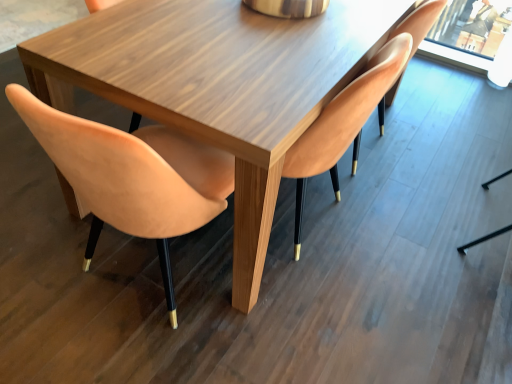
Question: Can you confirm if matte orange chair at upper right, the 3th chair in the left-to-right sequence, is taller than matte wood chair at center, which is the 2th chair from right to left?

Choices:
 (A) yes
 (B) no

Answer: (B)

Question: Can you confirm if matte orange chair at upper right, arranged as the 1th chair when viewed from the right, is smaller than matte wood chair at center, the 2th chair positioned from the left?

Choices:
 (A) yes
 (B) no

Answer: (A)

Question: Is matte orange chair at upper right, arranged as the 1th chair when viewed from the right, wider than matte wood chair at center, the 2th chair positioned from the left?

Choices:
 (A) yes
 (B) no

Answer: (B)

Question: From a real-world perspective, does matte orange chair at upper right, arranged as the 1th chair when viewed from the right, sit lower than matte wood chair at center, the 2th chair positioned from the left?

Choices:
 (A) yes
 (B) no

Answer: (A)

Question: Is matte orange chair at upper right, the 3th chair in the left-to-right sequence, looking in the opposite direction of matte wood chair at center, which is the 2th chair from right to left?

Choices:
 (A) yes
 (B) no

Answer: (B)

Question: Is matte orange chair at upper right, arranged as the 1th chair when viewed from the right, to the left of matte wood chair at center, the 2th chair positioned from the left, from the viewer's perspective?

Choices:
 (A) no
 (B) yes

Answer: (A)

Question: Is matte wood chair at center, which is the 2th chair from right to left, not close to suede-like peach chair at left, which ranks as the third chair in right-to-left order?

Choices:
 (A) no
 (B) yes

Answer: (A)

Question: Is matte wood chair at center, the 2th chair positioned from the left, shorter than suede-like peach chair at left, which ranks as the third chair in right-to-left order?

Choices:
 (A) yes
 (B) no

Answer: (B)

Question: Does matte wood chair at center, which is the 2th chair from right to left, have a smaller size compared to suede-like peach chair at left, which is counted as the first chair, starting from the left?

Choices:
 (A) no
 (B) yes

Answer: (A)

Question: Is matte wood chair at center, the 2th chair positioned from the left, wider than suede-like peach chair at left, which ranks as the third chair in right-to-left order?

Choices:
 (A) no
 (B) yes

Answer: (A)

Question: Is matte wood chair at center, which is the 2th chair from right to left, at the right side of suede-like peach chair at left, which is counted as the first chair, starting from the left?

Choices:
 (A) yes
 (B) no

Answer: (A)

Question: Is matte wood chair at center, the 2th chair positioned from the left, not within suede-like peach chair at left, which ranks as the third chair in right-to-left order?

Choices:
 (A) no
 (B) yes

Answer: (B)

Question: Is suede-like peach chair at left, which is counted as the first chair, starting from the left, turned away from matte wood chair at center, which is the 2th chair from right to left?

Choices:
 (A) no
 (B) yes

Answer: (A)